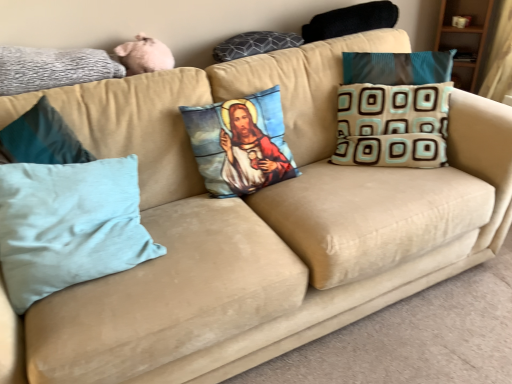
Locate an element on the screen. printed fabric pillow with religious imagery at center, the fourth pillow in the right-to-left sequence is located at coordinates (240, 144).

Image resolution: width=512 pixels, height=384 pixels. What do you see at coordinates (240, 144) in the screenshot?
I see `printed fabric pillow with religious imagery at center, the fourth pillow in the right-to-left sequence` at bounding box center [240, 144].

Find the location of `beige fabric pillow with blue and brown squares at right, which appears as the first pillow when viewed from the right`. beige fabric pillow with blue and brown squares at right, which appears as the first pillow when viewed from the right is located at coordinates (392, 125).

Locate an element on the screen. light blue fabric pillow at left, which is counted as the fifth pillow, starting from the right is located at coordinates [69, 225].

Image resolution: width=512 pixels, height=384 pixels. What do you see at coordinates (53, 68) in the screenshot? I see `gray textured pillow at upper left, which ranks as the 6th pillow in right-to-left order` at bounding box center [53, 68].

What do you see at coordinates (350, 21) in the screenshot? I see `black fuzzy pillow at upper right, marked as the second pillow in a right-to-left arrangement` at bounding box center [350, 21].

Where is `printed fabric pillow with religious imagery at center, the fourth pillow in the right-to-left sequence`? This screenshot has height=384, width=512. printed fabric pillow with religious imagery at center, the fourth pillow in the right-to-left sequence is located at coordinates (240, 144).

How many degrees apart are the facing directions of light blue fabric pillow at left, which ranks as the second pillow in left-to-right order, and printed fabric pillow with religious imagery at center, the fourth pillow in the right-to-left sequence?

0.000217 degrees separate the facing orientations of light blue fabric pillow at left, which ranks as the second pillow in left-to-right order, and printed fabric pillow with religious imagery at center, the fourth pillow in the right-to-left sequence.

Looking at this image, which object is positioned more to the right, light blue fabric pillow at left, which is counted as the fifth pillow, starting from the right, or printed fabric pillow with religious imagery at center, which is the third pillow in left-to-right order?

printed fabric pillow with religious imagery at center, which is the third pillow in left-to-right order.

Is light blue fabric pillow at left, which ranks as the second pillow in left-to-right order, looking in the opposite direction of printed fabric pillow with religious imagery at center, the fourth pillow in the right-to-left sequence?

light blue fabric pillow at left, which ranks as the second pillow in left-to-right order, is not turned away from printed fabric pillow with religious imagery at center, the fourth pillow in the right-to-left sequence.

Is light blue fabric pillow at left, which ranks as the second pillow in left-to-right order, in front of or behind printed fabric pillow with religious imagery at center, the fourth pillow in the right-to-left sequence, in the image?

light blue fabric pillow at left, which ranks as the second pillow in left-to-right order, is positioned closer to the viewer than printed fabric pillow with religious imagery at center, the fourth pillow in the right-to-left sequence.

From the image's perspective, is black fuzzy pillow at upper right, which appears as the 5th pillow when viewed from the left, under gray textured pillow at upper left, which ranks as the 6th pillow in right-to-left order?

No, from the image's perspective, black fuzzy pillow at upper right, which appears as the 5th pillow when viewed from the left, is not beneath gray textured pillow at upper left, which ranks as the 6th pillow in right-to-left order.

From a real-world perspective, does black fuzzy pillow at upper right, marked as the second pillow in a right-to-left arrangement, stand above gray textured pillow at upper left, the first pillow in the left-to-right sequence?

Actually, black fuzzy pillow at upper right, marked as the second pillow in a right-to-left arrangement, is physically below gray textured pillow at upper left, the first pillow in the left-to-right sequence, in the real world.

In the scene shown: Who is taller, black fuzzy pillow at upper right, marked as the second pillow in a right-to-left arrangement, or gray textured pillow at upper left, which ranks as the 6th pillow in right-to-left order?

Standing taller between the two is gray textured pillow at upper left, which ranks as the 6th pillow in right-to-left order.

From the beige fabric pillow with blue and brown squares at right, acting as the 6th pillow starting from the left, count the 2nd pillow to the left and point to it. Please provide its 2D coordinates.

[(254, 44)]

Is beige fabric pillow with blue and brown squares at right, which appears as the first pillow when viewed from the right, not close to dark gray textured pillow at upper center, which ranks as the fourth pillow in left-to-right order?

beige fabric pillow with blue and brown squares at right, which appears as the first pillow when viewed from the right, is actually quite close to dark gray textured pillow at upper center, which ranks as the fourth pillow in left-to-right order.

Is beige fabric pillow with blue and brown squares at right, acting as the 6th pillow starting from the left, smaller than dark gray textured pillow at upper center, placed as the 3th pillow when sorted from right to left?

No.

Could you tell me if beige fabric pillow with blue and brown squares at right, which appears as the first pillow when viewed from the right, is turned towards dark gray textured pillow at upper center, which ranks as the fourth pillow in left-to-right order?

No, beige fabric pillow with blue and brown squares at right, which appears as the first pillow when viewed from the right, is not aimed at dark gray textured pillow at upper center, which ranks as the fourth pillow in left-to-right order.

Is printed fabric pillow with religious imagery at center, which is the third pillow in left-to-right order, far from black fuzzy pillow at upper right, which appears as the 5th pillow when viewed from the left?

No, printed fabric pillow with religious imagery at center, which is the third pillow in left-to-right order, is in close proximity to black fuzzy pillow at upper right, which appears as the 5th pillow when viewed from the left.

Who is bigger, printed fabric pillow with religious imagery at center, the fourth pillow in the right-to-left sequence, or black fuzzy pillow at upper right, marked as the second pillow in a right-to-left arrangement?

Bigger between the two is printed fabric pillow with religious imagery at center, the fourth pillow in the right-to-left sequence.

Would you say printed fabric pillow with religious imagery at center, which is the third pillow in left-to-right order, contains black fuzzy pillow at upper right, marked as the second pillow in a right-to-left arrangement?

No.

Where is `the 3rd pillow behind when counting from the printed fabric pillow with religious imagery at center, the fourth pillow in the right-to-left sequence`? the 3rd pillow behind when counting from the printed fabric pillow with religious imagery at center, the fourth pillow in the right-to-left sequence is located at coordinates (350, 21).

Can you confirm if black fuzzy pillow at upper right, marked as the second pillow in a right-to-left arrangement, is positioned to the right of printed fabric pillow with religious imagery at center, which is the third pillow in left-to-right order?

Indeed, black fuzzy pillow at upper right, marked as the second pillow in a right-to-left arrangement, is positioned on the right side of printed fabric pillow with religious imagery at center, which is the third pillow in left-to-right order.

From the picture: Is black fuzzy pillow at upper right, which appears as the 5th pillow when viewed from the left, far from printed fabric pillow with religious imagery at center, the fourth pillow in the right-to-left sequence?

No, black fuzzy pillow at upper right, which appears as the 5th pillow when viewed from the left, is not far from printed fabric pillow with religious imagery at center, the fourth pillow in the right-to-left sequence.

Is beige fabric pillow with blue and brown squares at right, which appears as the first pillow when viewed from the right, oriented towards light blue fabric pillow at left, which ranks as the second pillow in left-to-right order?

No.

Considering the sizes of objects beige fabric pillow with blue and brown squares at right, which appears as the first pillow when viewed from the right, and light blue fabric pillow at left, which ranks as the second pillow in left-to-right order, in the image provided, who is smaller, beige fabric pillow with blue and brown squares at right, which appears as the first pillow when viewed from the right, or light blue fabric pillow at left, which ranks as the second pillow in left-to-right order,?

beige fabric pillow with blue and brown squares at right, which appears as the first pillow when viewed from the right, is smaller.

Between point (445, 99) and point (103, 218), which one is positioned in front?

Positioned in front is point (103, 218).

Consider the image. Which object is thinner, beige fabric pillow with blue and brown squares at right, which appears as the first pillow when viewed from the right, or light blue fabric pillow at left, which is counted as the fifth pillow, starting from the right?

Thinner between the two is beige fabric pillow with blue and brown squares at right, which appears as the first pillow when viewed from the right.

Is gray textured pillow at upper left, the first pillow in the left-to-right sequence, wider than black fuzzy pillow at upper right, which appears as the 5th pillow when viewed from the left?

No.

Considering the positions of point (18, 63) and point (344, 28), is point (18, 63) closer or farther from the camera than point (344, 28)?

Clearly, point (18, 63) is closer to the camera than point (344, 28).

From a real-world perspective, between gray textured pillow at upper left, which ranks as the 6th pillow in right-to-left order, and black fuzzy pillow at upper right, which appears as the 5th pillow when viewed from the left, who is vertically lower?

black fuzzy pillow at upper right, which appears as the 5th pillow when viewed from the left, is physically lower.

Considering the relative positions of gray textured pillow at upper left, which ranks as the 6th pillow in right-to-left order, and black fuzzy pillow at upper right, which appears as the 5th pillow when viewed from the left, in the image provided, is gray textured pillow at upper left, which ranks as the 6th pillow in right-to-left order, to the left or to the right of black fuzzy pillow at upper right, which appears as the 5th pillow when viewed from the left,?

gray textured pillow at upper left, which ranks as the 6th pillow in right-to-left order, is to the left of black fuzzy pillow at upper right, which appears as the 5th pillow when viewed from the left.

In order to click on the 2nd pillow behind the light blue fabric pillow at left, which is counted as the fifth pillow, starting from the right, starting your count from the anchor in this screenshot , I will do `click(240, 144)`.

Locate an element on the screen. This screenshot has width=512, height=384. pillow that is above the black fuzzy pillow at upper right, marked as the second pillow in a right-to-left arrangement (from a real-world perspective) is located at coordinates (53, 68).

Based on their spatial positions, is black fuzzy pillow at upper right, marked as the second pillow in a right-to-left arrangement, or gray textured pillow at upper left, the first pillow in the left-to-right sequence, closer to light blue fabric pillow at left, which is counted as the fifth pillow, starting from the right?

gray textured pillow at upper left, the first pillow in the left-to-right sequence.

When comparing their distances from gray textured pillow at upper left, which ranks as the 6th pillow in right-to-left order, does printed fabric pillow with religious imagery at center, which is the third pillow in left-to-right order, or beige fabric pillow with blue and brown squares at right, which appears as the first pillow when viewed from the right, seem closer?

printed fabric pillow with religious imagery at center, which is the third pillow in left-to-right order, is closer to gray textured pillow at upper left, which ranks as the 6th pillow in right-to-left order.

From the image, which object appears to be nearer to beige fabric pillow with blue and brown squares at right, which appears as the first pillow when viewed from the right, gray textured pillow at upper left, which ranks as the 6th pillow in right-to-left order, or black fuzzy pillow at upper right, which appears as the 5th pillow when viewed from the left?

The object closer to beige fabric pillow with blue and brown squares at right, which appears as the first pillow when viewed from the right, is black fuzzy pillow at upper right, which appears as the 5th pillow when viewed from the left.

Estimate the real-world distances between objects in this image. Which object is closer to light blue fabric pillow at left, which ranks as the second pillow in left-to-right order, printed fabric pillow with religious imagery at center, which is the third pillow in left-to-right order, or beige fabric pillow with blue and brown squares at right, acting as the 6th pillow starting from the left?

printed fabric pillow with religious imagery at center, which is the third pillow in left-to-right order, is positioned closer to the anchor light blue fabric pillow at left, which ranks as the second pillow in left-to-right order.

When comparing their distances from black fuzzy pillow at upper right, marked as the second pillow in a right-to-left arrangement, does printed fabric pillow with religious imagery at center, the fourth pillow in the right-to-left sequence, or light blue fabric pillow at left, which ranks as the second pillow in left-to-right order, seem closer?

printed fabric pillow with religious imagery at center, the fourth pillow in the right-to-left sequence, is closer to black fuzzy pillow at upper right, marked as the second pillow in a right-to-left arrangement.

Estimate the real-world distances between objects in this image. Which object is further from black fuzzy pillow at upper right, marked as the second pillow in a right-to-left arrangement, gray textured pillow at upper left, which ranks as the 6th pillow in right-to-left order, or light blue fabric pillow at left, which ranks as the second pillow in left-to-right order?

The object further to black fuzzy pillow at upper right, marked as the second pillow in a right-to-left arrangement, is light blue fabric pillow at left, which ranks as the second pillow in left-to-right order.

When comparing their distances from printed fabric pillow with religious imagery at center, which is the third pillow in left-to-right order, does beige fabric pillow with blue and brown squares at right, which appears as the first pillow when viewed from the right, or dark gray textured pillow at upper center, which ranks as the fourth pillow in left-to-right order, seem further?

Among the two, beige fabric pillow with blue and brown squares at right, which appears as the first pillow when viewed from the right, is located further to printed fabric pillow with religious imagery at center, which is the third pillow in left-to-right order.

Consider the image. From the image, which object appears to be farther from black fuzzy pillow at upper right, which appears as the 5th pillow when viewed from the left, beige fabric pillow with blue and brown squares at right, which appears as the first pillow when viewed from the right, or dark gray textured pillow at upper center, which ranks as the fourth pillow in left-to-right order?

beige fabric pillow with blue and brown squares at right, which appears as the first pillow when viewed from the right, is further to black fuzzy pillow at upper right, which appears as the 5th pillow when viewed from the left.

Where is `pillow between dark gray textured pillow at upper center, placed as the 3th pillow when sorted from right to left, and beige fabric pillow with blue and brown squares at right, acting as the 6th pillow starting from the left`? The height and width of the screenshot is (384, 512). pillow between dark gray textured pillow at upper center, placed as the 3th pillow when sorted from right to left, and beige fabric pillow with blue and brown squares at right, acting as the 6th pillow starting from the left is located at coordinates (350, 21).

I want to click on pillow between gray textured pillow at upper left, which ranks as the 6th pillow in right-to-left order, and printed fabric pillow with religious imagery at center, which is the third pillow in left-to-right order, from left to right, so click(x=69, y=225).